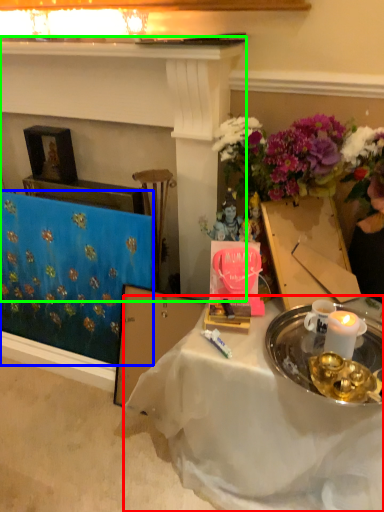
Question: Estimate the real-world distances between objects in this image. Which object is closer to desk (highlighted by a red box), tablecloth (highlighted by a blue box) or fireplace (highlighted by a green box)?

Choices:
 (A) tablecloth
 (B) fireplace

Answer: (A)